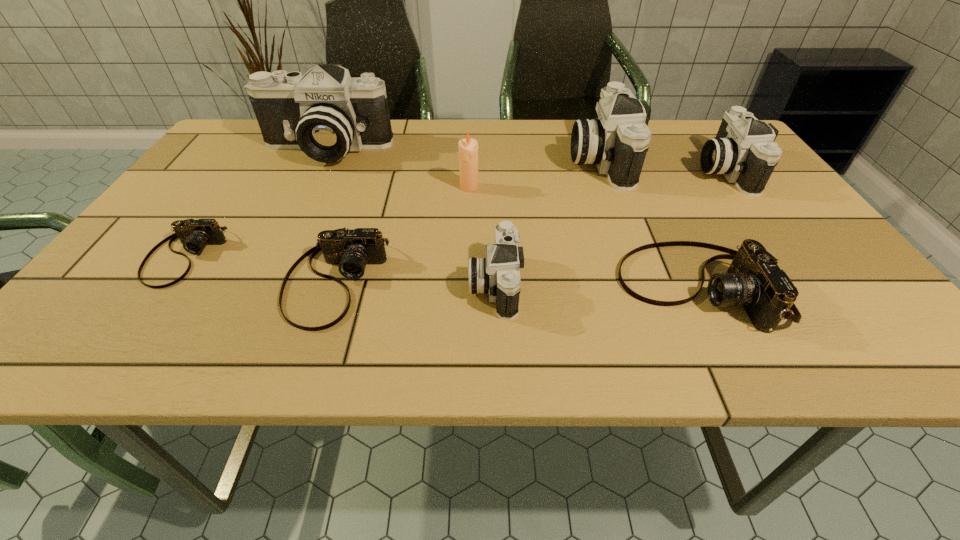
Find the location of a particular element. the tallest object is located at coordinates (325, 113).

Image resolution: width=960 pixels, height=540 pixels. In order to click on the leftmost black camera in this screenshot , I will do `click(325, 113)`.

Locate an element on the screen. the second tallest object is located at coordinates (617, 141).

Locate an element on the screen. the second tallest camera is located at coordinates (617, 141).

Where is `the fifth shortest camera`? the fifth shortest camera is located at coordinates (744, 151).

The width and height of the screenshot is (960, 540). In order to click on the third biggest black camera in this screenshot , I will do `click(744, 151)`.

Where is `candle`? The width and height of the screenshot is (960, 540). candle is located at coordinates (468, 148).

Where is `the fourth shortest object`? the fourth shortest object is located at coordinates (498, 274).

The width and height of the screenshot is (960, 540). Find the location of `the fourth shortest camera`. the fourth shortest camera is located at coordinates (498, 274).

Where is `the sixth tallest object`? The height and width of the screenshot is (540, 960). the sixth tallest object is located at coordinates (753, 280).